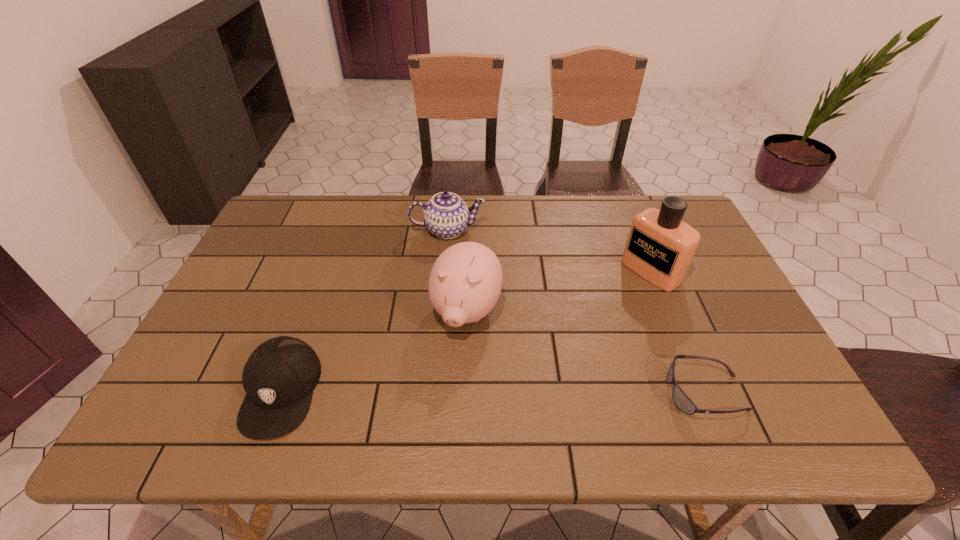
Locate which object is the closest to the perfume. Please provide its 2D coordinates. Your answer should be formatted as a tuple, i.e. [(x, y)], where the tuple contains the x and y coordinates of a point satisfying the conditions above.

[(681, 400)]

This screenshot has width=960, height=540. I want to click on free location that satisfies the following two spatial constraints: 1. on the front side of the piggy bank; 2. on the lenses of the sunglasses, so click(x=465, y=392).

Locate an element on the screen. The image size is (960, 540). free space that satisfies the following two spatial constraints: 1. on the front side of the piggy bank; 2. on the left side of the chinaware is located at coordinates (x=441, y=312).

At what (x,y) coordinates should I click in order to perform the action: click on free space in the image that satisfies the following two spatial constraints: 1. on the front-facing side of the leftmost object; 2. on the lenses of the shortest object. Please return your answer as a coordinate pair (x, y). Looking at the image, I should click on (280, 392).